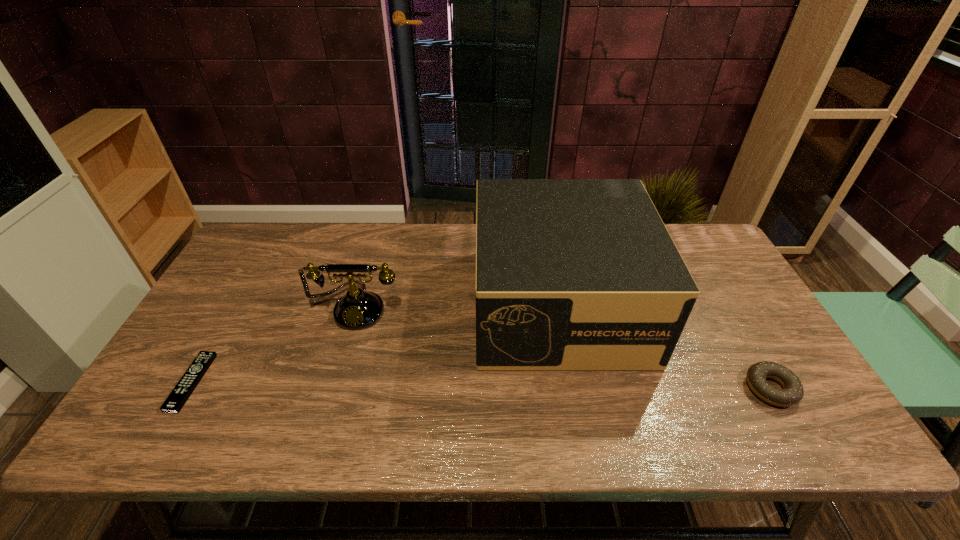
The image size is (960, 540). In order to click on the second object from right to left in this screenshot , I will do `click(571, 274)`.

Where is `the tallest object`? This screenshot has width=960, height=540. the tallest object is located at coordinates (571, 274).

Where is `telephone`? This screenshot has width=960, height=540. telephone is located at coordinates (357, 310).

At what (x,y) coordinates should I click in order to perform the action: click on the second tallest object. Please return your answer as a coordinate pair (x, y). This screenshot has height=540, width=960. Looking at the image, I should click on (357, 310).

This screenshot has width=960, height=540. Find the location of `the rightmost object`. the rightmost object is located at coordinates (792, 392).

Find the location of a particular element. The image size is (960, 540). doughnut is located at coordinates (792, 392).

Find the location of a particular element. the leftmost object is located at coordinates (182, 391).

Locate an element on the screen. the shortest object is located at coordinates (182, 391).

Identify the location of vacant region located on the front-facing side of the tallest object. This screenshot has width=960, height=540. (582, 431).

What are the coordinates of `vacant point located on the dial of the telephone` in the screenshot? It's located at (329, 407).